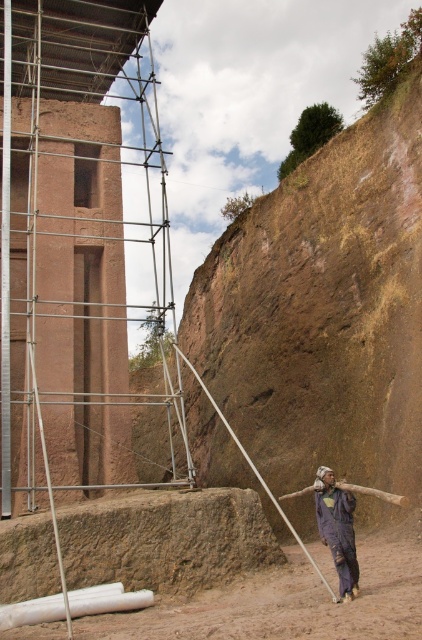
Which is above, brown dirt field at lower right or dark blue fabric at lower center?

dark blue fabric at lower center is above.

Can you confirm if brown dirt field at lower right is positioned to the right of dark blue fabric at lower center?

In fact, brown dirt field at lower right is to the left of dark blue fabric at lower center.

Who is more distant from viewer, (411, 620) or (318, 504)?

Positioned behind is point (318, 504).

At what (x,y) coordinates should I click in order to perform the action: click on brown dirt field at lower right. Please return your answer as a coordinate pair (x, y). Looking at the image, I should click on (286, 602).